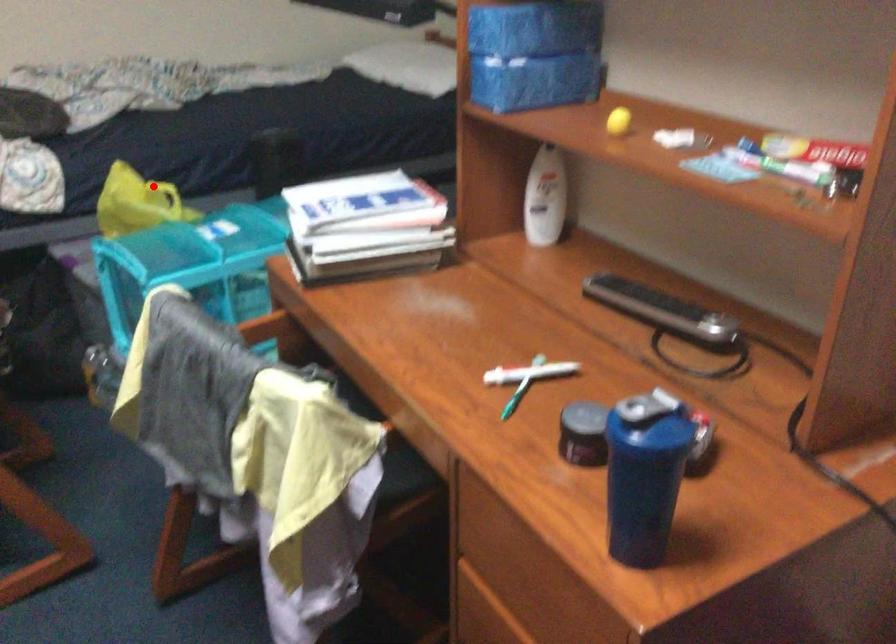
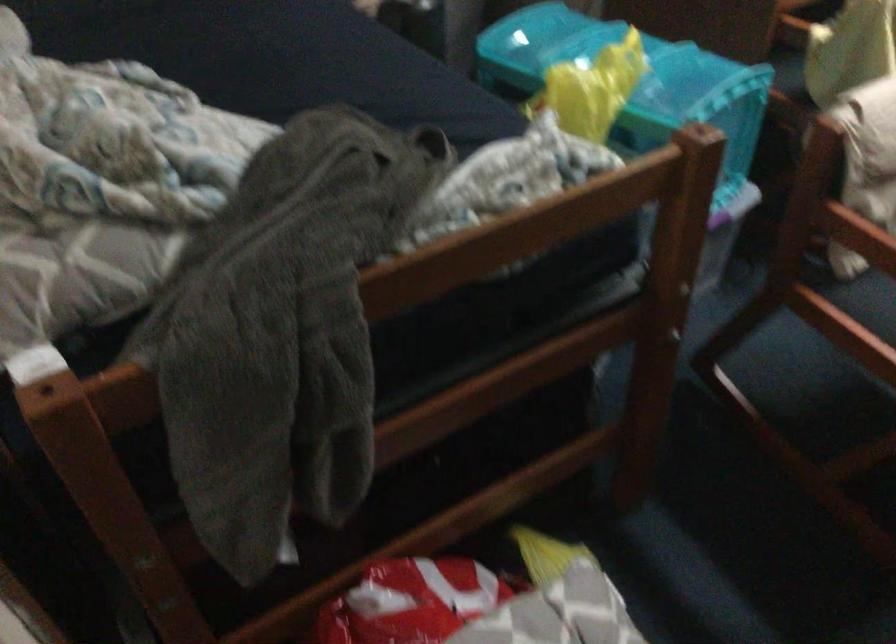
Question: I am providing you with two images of the same scene from different viewpoints. A red point is shown in image1. For the corresponding object point in image2, is it positioned nearer or farther from the camera?

Choices:
 (A) Nearer
 (B) Farther

Answer: (A)